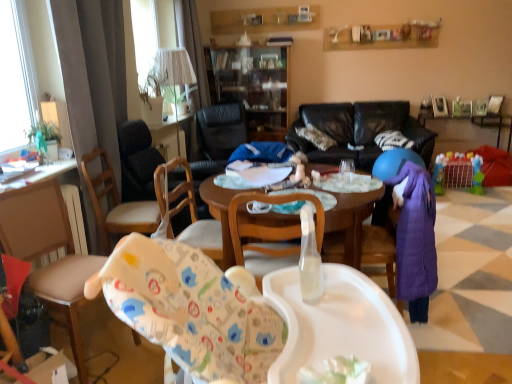
Describe the element at coordinates (45, 139) in the screenshot. I see `green leafy plant at left` at that location.

Measure the distance between wooden chair at left, which is counted as the fourth chair, starting from the back, and camera.

A distance of 5.96 feet exists between wooden chair at left, which is counted as the fourth chair, starting from the back, and camera.

Describe the element at coordinates (48, 252) in the screenshot. I see `wooden chair at left, marked as the 1th chair in a front-to-back arrangement` at that location.

Identify the location of black leather chair at center, the 1th chair in the back-to-front sequence. The height and width of the screenshot is (384, 512). (220, 130).

Where is `white glossy table at left, which appears as the second table when viewed from the right`? white glossy table at left, which appears as the second table when viewed from the right is located at coordinates (41, 174).

From the picture: From the image's perspective, relative to plastic colorful playpen at right, is white glossy table at left, the 1th table from the left, above or below?

Based on their image positions, white glossy table at left, the 1th table from the left, is located beneath plastic colorful playpen at right.

Is white glossy table at left, which ranks as the 2th table in top-to-bottom order, not inside plastic colorful playpen at right?

Yes, white glossy table at left, which ranks as the 2th table in top-to-bottom order, is outside of plastic colorful playpen at right.

Is white glossy table at left, which appears as the 1th table when ordered from the bottom, placed right next to plastic colorful playpen at right?

There is a gap between white glossy table at left, which appears as the 1th table when ordered from the bottom, and plastic colorful playpen at right.

Between transparent glass cabinet at center and black leather chair at center, the 1th chair in the back-to-front sequence, which one has larger size?

With larger size is transparent glass cabinet at center.

From their relative heights in the image, would you say transparent glass cabinet at center is taller or shorter than black leather chair at center, the 1th chair in the back-to-front sequence?

Considering their sizes, transparent glass cabinet at center has more height than black leather chair at center, the 1th chair in the back-to-front sequence.

Looking at their sizes, would you say transparent glass cabinet at center is wider or thinner than black leather chair at center, placed as the 4th chair when sorted from front to back?

transparent glass cabinet at center is thinner than black leather chair at center, placed as the 4th chair when sorted from front to back.

Measure the distance between transparent glass cabinet at center and black leather chair at center, placed as the 4th chair when sorted from front to back.

transparent glass cabinet at center and black leather chair at center, placed as the 4th chair when sorted from front to back, are 17.53 inches apart from each other.

Is plastic colorful playpen at right touching plastic toy basket at lower right, which is the 1th table in top-to-bottom order?

plastic colorful playpen at right and plastic toy basket at lower right, which is the 1th table in top-to-bottom order, are not in contact.

Is plastic colorful playpen at right bigger or smaller than plastic toy basket at lower right, which is the second table from front to back?

In the image, plastic colorful playpen at right appears to be smaller than plastic toy basket at lower right, which is the second table from front to back.

From a real-world perspective, is plastic colorful playpen at right located beneath plastic toy basket at lower right, which is the 1th table in top-to-bottom order?

Yes, from a real-world perspective, plastic colorful playpen at right is under plastic toy basket at lower right, which is the 1th table in top-to-bottom order.

Who is taller, plastic colorful playpen at right or plastic toy basket at lower right, which is the 1th table in top-to-bottom order?

With more height is plastic toy basket at lower right, which is the 1th table in top-to-bottom order.

Starting from the white soft pillow at center, which chair is the 1st one to the left? Please provide its 2D coordinates.

[(270, 235)]

Is white soft pillow at center aimed at wooden chair at center, which is the 2th chair in front-to-back order?

Yes, white soft pillow at center is oriented towards wooden chair at center, which is the 2th chair in front-to-back order.

Considering the relative positions of white soft pillow at center and wooden chair at center, which is the 2th chair in front-to-back order, in the image provided, is white soft pillow at center in front of wooden chair at center, which is the 2th chair in front-to-back order,?

No, it is behind wooden chair at center, which is the 2th chair in front-to-back order.

Which object is further away from the camera, black leather couch at center or wooden chair at center, which ranks as the third chair in front-to-back order?

Positioned behind is black leather couch at center.

Is black leather couch at center at the right side of wooden chair at center, the 2th chair viewed from the back?

Correct, you'll find black leather couch at center to the right of wooden chair at center, the 2th chair viewed from the back.

Considering the sizes of objects black leather couch at center and wooden chair at center, which ranks as the third chair in front-to-back order, in the image provided, who is taller, black leather couch at center or wooden chair at center, which ranks as the third chair in front-to-back order,?

black leather couch at center is taller.

Based on the photo, in terms of width, does black leather couch at center look wider or thinner when compared to wooden chair at center, which ranks as the third chair in front-to-back order?

black leather couch at center is wider than wooden chair at center, which ranks as the third chair in front-to-back order.

Is white soft pillow at center facing away from plastic colorful playpen at right?

No, white soft pillow at center is not facing the opposite direction of plastic colorful playpen at right.

Who is taller, white soft pillow at center or plastic colorful playpen at right?

With more height is plastic colorful playpen at right.

Which object is thinner, white soft pillow at center or plastic colorful playpen at right?

Thinner between the two is plastic colorful playpen at right.

Is the surface of white soft pillow at center in direct contact with plastic colorful playpen at right?

No, white soft pillow at center is not with plastic colorful playpen at right.

Which object is further away from the camera taking this photo, black leather couch at center or wooden chair at left, which is counted as the fourth chair, starting from the back?

black leather couch at center.

Looking at this image, is black leather couch at center facing away from wooden chair at left, which is counted as the fourth chair, starting from the back?

No.

From the picture: Which is farther, (433,135) or (45,225)?

The point (433,135) is more distant.

The width and height of the screenshot is (512, 384). I want to click on toy behind the white glossy table at left, the 1th table from the left, so click(458, 172).

There is a transparent glass cabinet at center. At what (x,y) coordinates should I click in order to perform the action: click on the 1st chair below it (from a real-world perspective). Please return your answer as a coordinate pair (x, y). This screenshot has height=384, width=512. Looking at the image, I should click on (220, 130).

When comparing their distances from black leather couch at center, does white fabric lampshade at upper center or black leather chair at center, placed as the 4th chair when sorted from front to back, seem further?

white fabric lampshade at upper center is further to black leather couch at center.

Looking at the image, which one is located closer to wooden chair at left, which is counted as the fourth chair, starting from the back, black leather couch at center or black leather chair at center, the 1th chair in the back-to-front sequence?

black leather couch at center lies closer to wooden chair at left, which is counted as the fourth chair, starting from the back, than the other object.

Based on their spatial positions, is plastic toy basket at lower right, which is counted as the 2th table, starting from the left, or wooden chair at left, which is counted as the fourth chair, starting from the back, further from wooden chair at center, which ranks as the third chair in front-to-back order?

plastic toy basket at lower right, which is counted as the 2th table, starting from the left, is further to wooden chair at center, which ranks as the third chair in front-to-back order.

Estimate the real-world distances between objects in this image. Which object is closer to wooden chair at center, the 2th chair viewed from the back, wooden chair at left, which is counted as the fourth chair, starting from the back, or white fabric lampshade at upper center?

wooden chair at left, which is counted as the fourth chair, starting from the back.

Considering their positions, is green leafy plant at left positioned further to white glossy table at left, which ranks as the 2th table in top-to-bottom order, than plastic toy basket at lower right, which is the second table from front to back?

plastic toy basket at lower right, which is the second table from front to back, lies further to white glossy table at left, which ranks as the 2th table in top-to-bottom order, than the other object.

Considering their positions, is plastic colorful playpen at right positioned closer to wooden chair at left, marked as the 1th chair in a front-to-back arrangement, than wooden chair at center, acting as the 3th chair starting from the back?

Based on the image, wooden chair at center, acting as the 3th chair starting from the back, appears to be nearer to wooden chair at left, marked as the 1th chair in a front-to-back arrangement.

Looking at this image, from the image, which object appears to be farther from plastic toy basket at lower right, acting as the 1th table starting from the back, black leather chair at center, placed as the 4th chair when sorted from front to back, or plastic colorful playpen at right?

black leather chair at center, placed as the 4th chair when sorted from front to back, is positioned further to the anchor plastic toy basket at lower right, acting as the 1th table starting from the back.

When comparing their distances from plastic toy basket at lower right, which is the second table from front to back, does transparent glass cabinet at center or wooden chair at center, which is the 2th chair in front-to-back order, seem closer?

transparent glass cabinet at center is positioned closer to the anchor plastic toy basket at lower right, which is the second table from front to back.

The height and width of the screenshot is (384, 512). What are the coordinates of `chair located between wooden chair at center, which ranks as the third chair in front-to-back order, and white soft pillow at center in the depth direction` in the screenshot? It's located at (220, 130).

The image size is (512, 384). What are the coordinates of `houseplant positioned between wooden chair at center, acting as the 3th chair starting from the back, and black leather chair at center, placed as the 4th chair when sorted from front to back, from near to far` in the screenshot? It's located at (45, 139).

Image resolution: width=512 pixels, height=384 pixels. Identify the location of cabinetry between green leafy plant at left and plastic toy basket at lower right, which is the second table from front to back, in the horizontal direction. (252, 86).

Identify the location of toy between wooden chair at center, which is the 2th chair in front-to-back order, and plastic toy basket at lower right, which is the 1th table in top-to-bottom order, in the front-back direction. Image resolution: width=512 pixels, height=384 pixels. (458, 172).